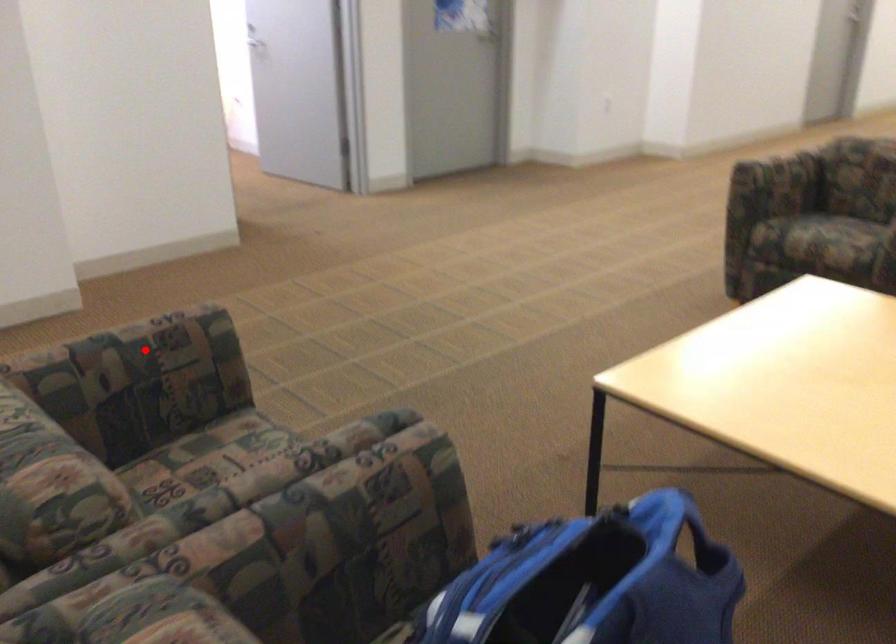
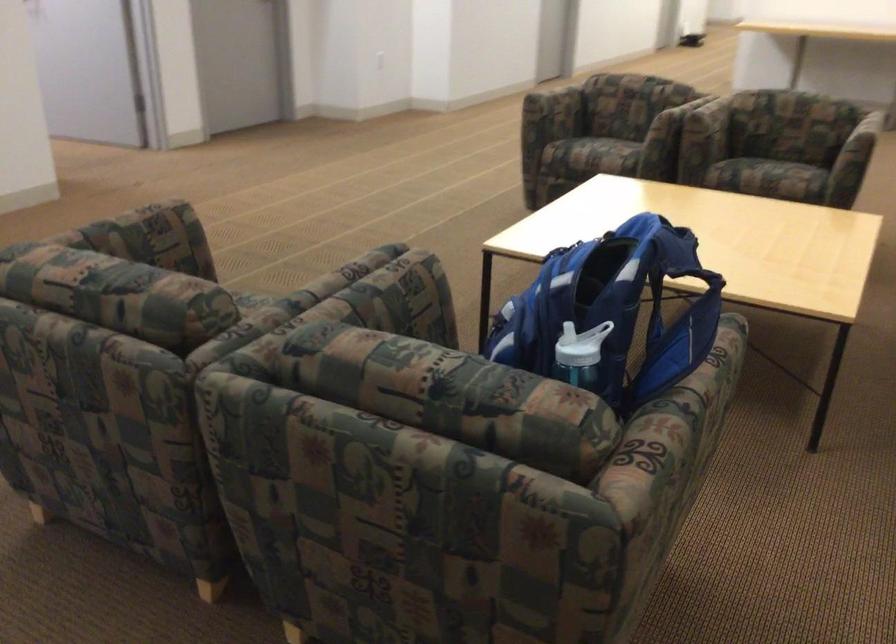
Question: I am providing you with two images of the same scene from different viewpoints. Given a red point in image1, look at the same physical point in image2. Is it:

Choices:
 (A) Closer to the viewpoint
 (B) Farther from the viewpoint

Answer: (B)